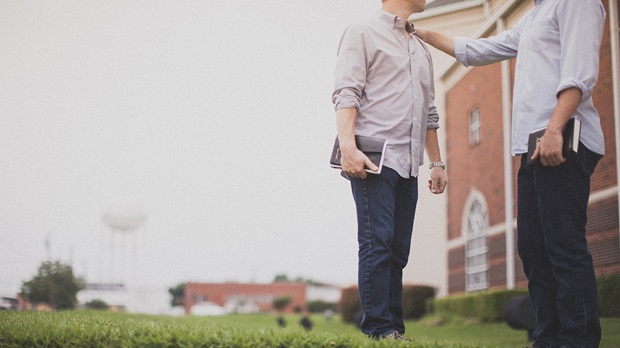
The width and height of the screenshot is (620, 348). What are the coordinates of `books` in the screenshot? It's located at (570, 136), (376, 147).